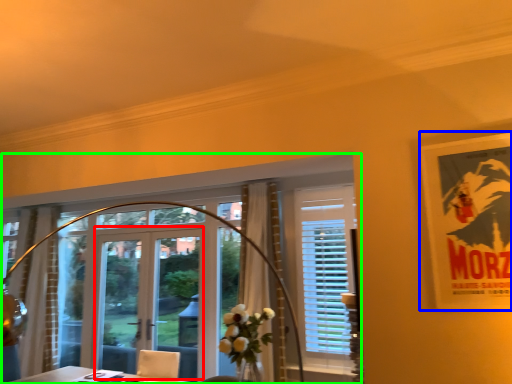
Question: Based on their relative distances, which object is nearer to screen door (highlighted by a red box)? Choose from poster page (highlighted by a blue box) and window (highlighted by a green box).

Choices:
 (A) poster page
 (B) window

Answer: (B)